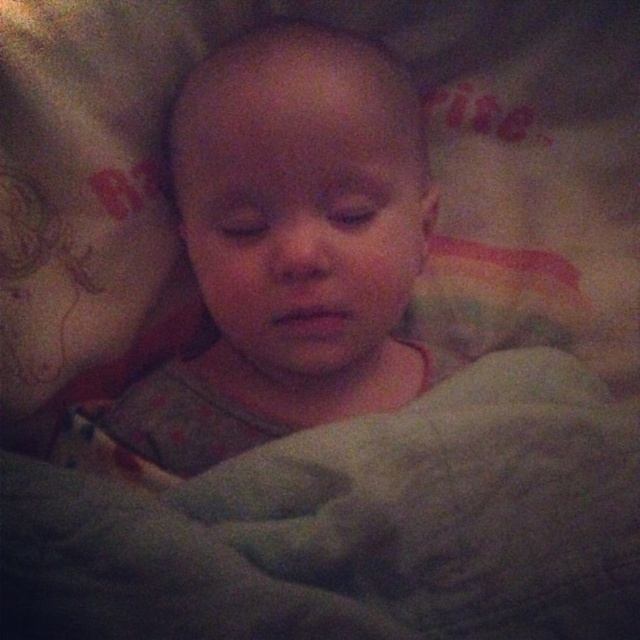
Question: Is soft gray fabric at lower center positioned before smooth gray baby at center?

Choices:
 (A) yes
 (B) no

Answer: (A)

Question: Does soft gray fabric at lower center appear over smooth gray baby at center?

Choices:
 (A) yes
 (B) no

Answer: (B)

Question: Can you confirm if soft gray fabric at lower center is positioned above smooth gray baby at center?

Choices:
 (A) no
 (B) yes

Answer: (A)

Question: Which object is closer to the camera taking this photo?

Choices:
 (A) soft gray fabric at lower center
 (B) smooth gray baby at center

Answer: (A)